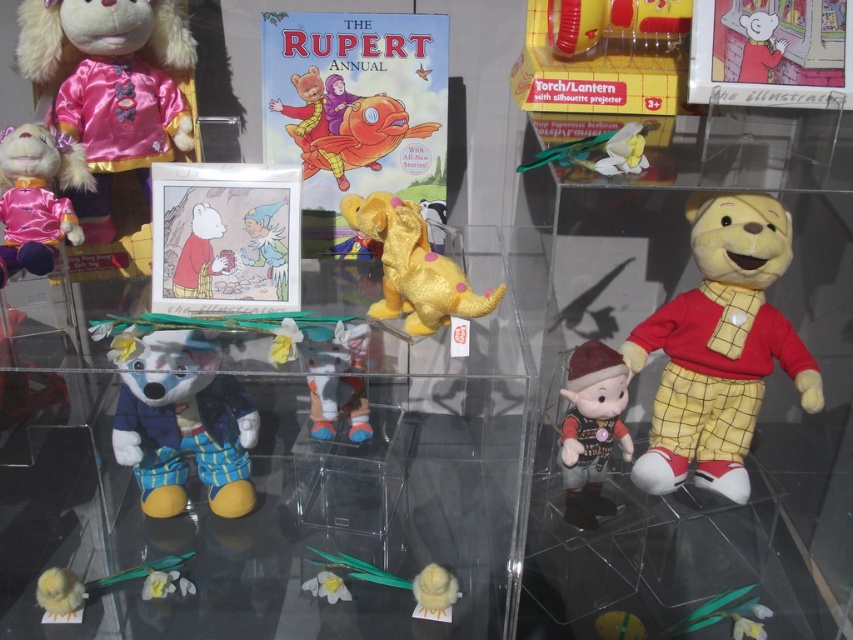
You are a museum guide explaining the Rupert Bear display. You need to inform visitors about the size difference between the velvet plush toy at center and the matte red plush bear at upper left. How would you describe their sizes?

The velvet plush toy at center is larger in size compared to the matte red plush bear at upper left.

You are a visitor at the Rupert Bear exhibition and want to take a photo of the velvet plush toy at center without the matte red plush bear at upper left appearing in the background. Is this possible given their positions?

The velvet plush toy at center is in front of the matte red plush bear at upper left, so yes, you can take a photo of the velvet plush toy at center without the matte red plush bear at upper left appearing in the background by positioning yourself so the velvet plush toy at center blocks the view of the matte red plush bear at upper left.